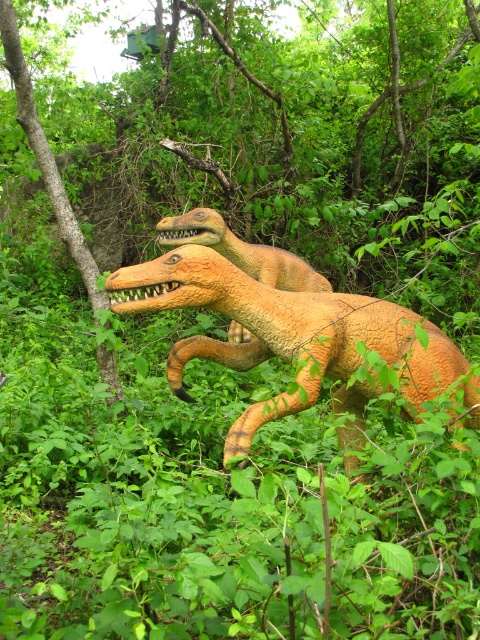
You are a park visitor observing the two dinosaur models in the forest. You notice both an orange textured dinosaur at center and an orange matte dinosaur at center. Which one is located to the right of the other?

The orange textured dinosaur at center is positioned on the right side of the orange matte dinosaur at center.

You are a visitor at a dinosaur exhibit and want to take a photo of both the orange textured dinosaur at center and the orange matte dinosaur at center. The camera you have can focus on objects within a 2 meter range. Will you be able to capture both dinosaurs in a single photo without moving the camera?

The orange textured dinosaur at center and orange matte dinosaur at center are 1.82 meters apart from each other, which is within the 2 meter range of the camera. Therefore, you can capture both dinosaurs in a single photo without moving the camera.

You are a visitor at a dinosaur exhibit and see the orange textured dinosaur at center and the orange matte dinosaur at center. Which one is taller?

The orange textured dinosaur at center is much taller than the orange matte dinosaur at center.